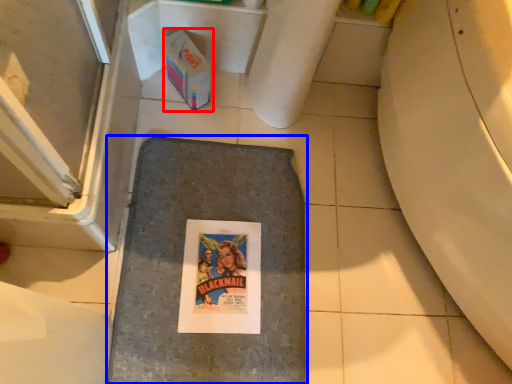
Question: Which object is further to the camera taking this photo, cardboard box (highlighted by a red box) or bath mat (highlighted by a blue box)?

Choices:
 (A) cardboard box
 (B) bath mat

Answer: (A)